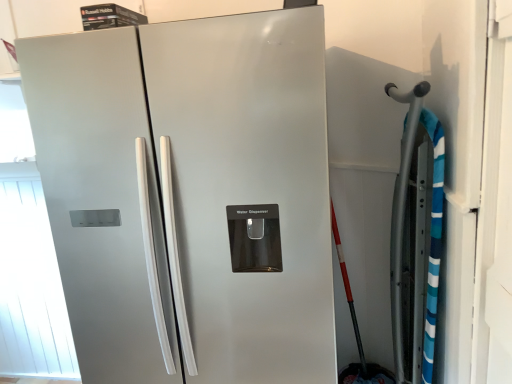
Question: Should I look upward or downward to see satin silver refrigerator at left?

Choices:
 (A) down
 (B) up

Answer: (A)